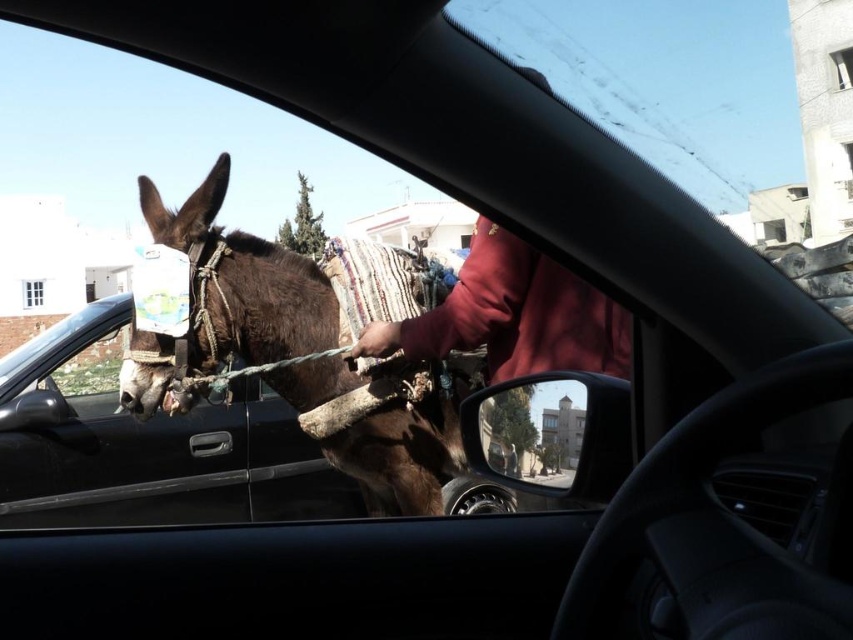
Question: Which object is closer to the camera taking this photo?

Choices:
 (A) red fleece jacket at center
 (B) brown fuzzy mule at left

Answer: (A)

Question: Is the position of brown fuzzy mule at left more distant than that of red fleece jacket at center?

Choices:
 (A) yes
 (B) no

Answer: (A)

Question: Does brown fuzzy mule at left have a lesser width compared to red fleece jacket at center?

Choices:
 (A) no
 (B) yes

Answer: (A)

Question: Which of the following is the farthest from the observer?

Choices:
 (A) (119, 384)
 (B) (450, 307)

Answer: (A)

Question: Does brown fuzzy mule at left have a greater width compared to red fleece jacket at center?

Choices:
 (A) no
 (B) yes

Answer: (B)